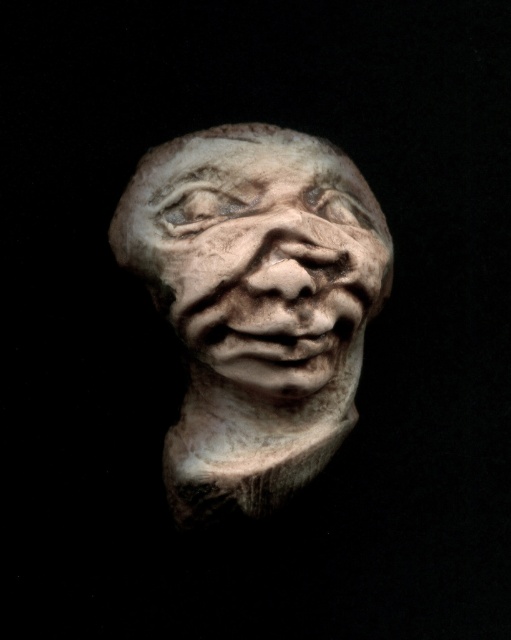
You are an art student observing the sculpture. You notice two parts of the sculpture labeled as the white clay bust at center and the white stone face at center. Which part is located to the left?

The white clay bust at center is positioned on the left side of the white stone face at center, so the white clay bust at center is located to the left.

Consider the image. You are an art student analyzing the sculpture. You notice a specific point at coordinates (256, 305). What does this point correspond to in the sculpture?

The point at coordinates (256, 305) corresponds to the white clay bust at center.

You are an art student standing in front of a sculpture. You need to place a small plaque exactly at the center of the white clay bust at center. According to the coordinates provided, where should you place the plaque?

The plaque should be placed at the coordinates point (x=256, y=305) since that is the position of the white clay bust at center.